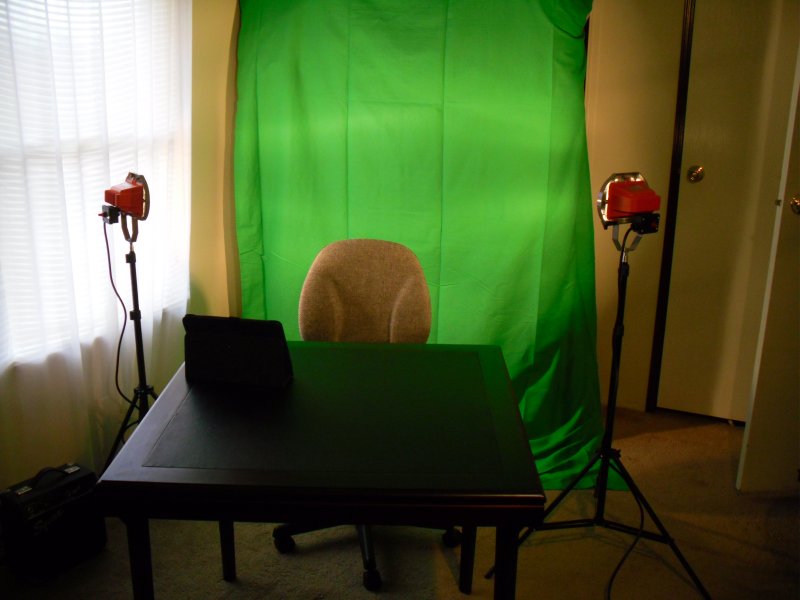
Locate an element on the screen. lighting is located at coordinates (118, 205), (626, 205).